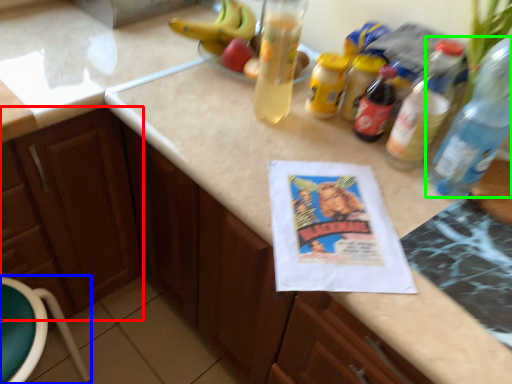
Question: Which is farther away from cabinetry (highlighted by a red box)? bar stool (highlighted by a blue box) or bottle (highlighted by a green box)?

Choices:
 (A) bar stool
 (B) bottle

Answer: (B)